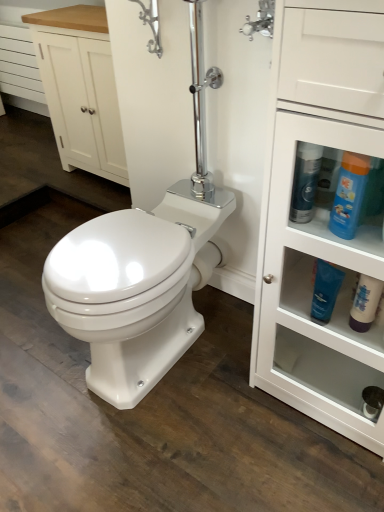
Question: Is white matte bottle at lower right, which is the first cleaning product from right to left, further to the viewer compared to blue glossy tube at lower right, the third cleaning product viewed from the right?

Choices:
 (A) no
 (B) yes

Answer: (B)

Question: From the image's perspective, would you say white matte bottle at lower right, which is the first cleaning product from right to left, is positioned over blue glossy tube at lower right, the third cleaning product viewed from the right?

Choices:
 (A) yes
 (B) no

Answer: (B)

Question: Could you tell me if white matte bottle at lower right, which is the first cleaning product from right to left, is facing blue glossy tube at lower right, acting as the 2th cleaning product starting from the left?

Choices:
 (A) yes
 (B) no

Answer: (B)

Question: Would you say white matte bottle at lower right, which is the first cleaning product from right to left, is a long distance from blue glossy tube at lower right, acting as the 2th cleaning product starting from the left?

Choices:
 (A) yes
 (B) no

Answer: (B)

Question: From a real-world perspective, is white matte bottle at lower right, which is the first cleaning product from right to left, located beneath blue glossy tube at lower right, acting as the 2th cleaning product starting from the left?

Choices:
 (A) yes
 (B) no

Answer: (A)

Question: Is white matte bottle at lower right, which is the first cleaning product from right to left, placed right next to blue glossy tube at lower right, acting as the 2th cleaning product starting from the left?

Choices:
 (A) no
 (B) yes

Answer: (B)

Question: Does white wood cabinet at upper left appear on the left side of blue plastic bottle at upper right, which is the 3th cleaning product in left-to-right order?

Choices:
 (A) yes
 (B) no

Answer: (A)

Question: Can you confirm if white wood cabinet at upper left is wider than blue plastic bottle at upper right, which is the 3th cleaning product in left-to-right order?

Choices:
 (A) yes
 (B) no

Answer: (A)

Question: Does white wood cabinet at upper left have a larger size compared to blue plastic bottle at upper right, the second cleaning product when ordered from right to left?

Choices:
 (A) no
 (B) yes

Answer: (B)

Question: Is white wood cabinet at upper left further to the viewer compared to blue plastic bottle at upper right, which is the 3th cleaning product in left-to-right order?

Choices:
 (A) yes
 (B) no

Answer: (A)

Question: Is blue plastic bottle at upper right, which is the 3th cleaning product in left-to-right order, inside white wood cabinet at upper left?

Choices:
 (A) yes
 (B) no

Answer: (B)

Question: Is white wood cabinet at upper left closer to camera compared to blue plastic bottle at upper right, which is the 3th cleaning product in left-to-right order?

Choices:
 (A) no
 (B) yes

Answer: (A)

Question: Considering the relative positions of white wood cabinet at upper left and white wood drawer at upper left in the image provided, is white wood cabinet at upper left to the left of white wood drawer at upper left from the viewer's perspective?

Choices:
 (A) no
 (B) yes

Answer: (A)